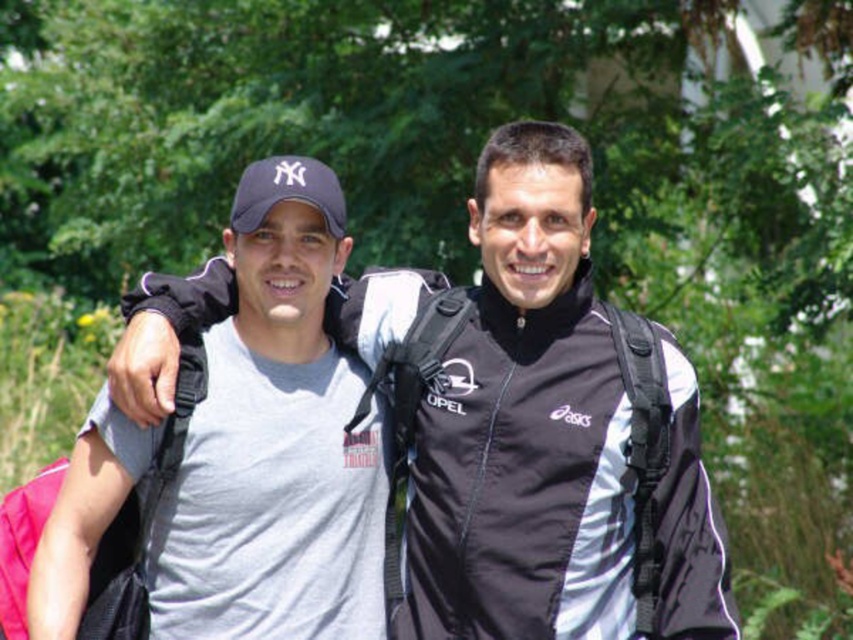
You are a photographer trying to capture a photo of the matte black jacket at center and the matte blue baseball cap at left. Based on their positions, which object should you focus on first to ensure both are in the frame?

The matte blue baseball cap at left should be focused on first since it is above the matte black jacket at center, ensuring both are in the frame by starting from the higher position.

You are a photographer trying to capture both the matte black jacket at center and the matte blue baseball cap at left in a single frame. Based on their sizes, which object should you focus on first to ensure both fit in the shot?

The matte black jacket at center is wider than the matte blue baseball cap at left, so you should focus on positioning the matte black jacket at center first to ensure both fit in the frame.